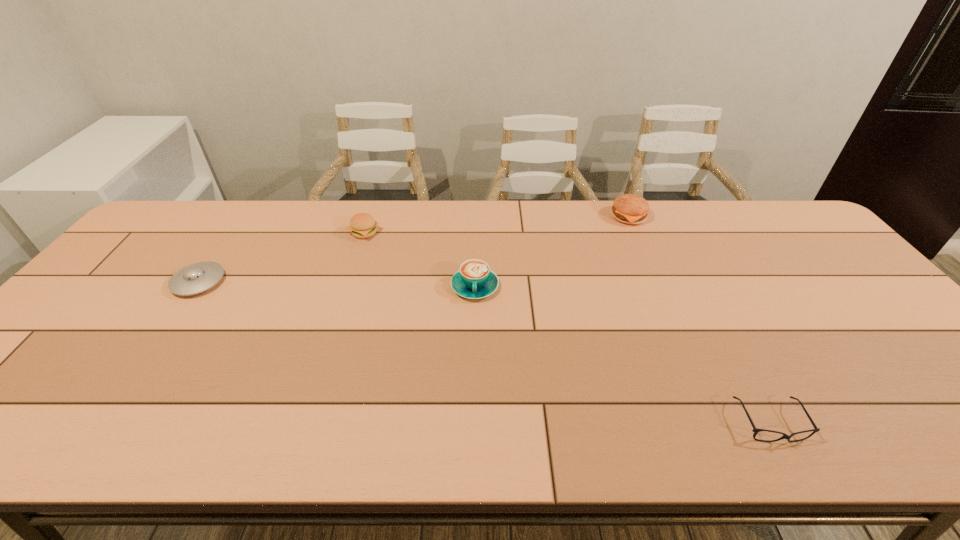
Find the location of a particular element. vacant space that is in between the spectacles and the leftmost object is located at coordinates (484, 353).

Identify the location of free point between the leftmost object and the cappuccino. (337, 284).

This screenshot has width=960, height=540. Identify the location of vacant area that lies between the saucer and the left hamburger. (281, 257).

Where is `vacant area that lies between the right hamburger and the third object from right to left`? The height and width of the screenshot is (540, 960). vacant area that lies between the right hamburger and the third object from right to left is located at coordinates (552, 252).

The width and height of the screenshot is (960, 540). I want to click on object that stands as the third closest to the spectacles, so click(x=362, y=225).

Select which object appears as the third closest to the fourth object from right to left. Please provide its 2D coordinates. Your answer should be formatted as a tuple, i.e. [(x, y)], where the tuple contains the x and y coordinates of a point satisfying the conditions above.

[(627, 208)]

Locate an element on the screen. free spot that satisfies the following two spatial constraints: 1. on the back side of the leftmost object; 2. on the right side of the fourth object from right to left is located at coordinates (233, 233).